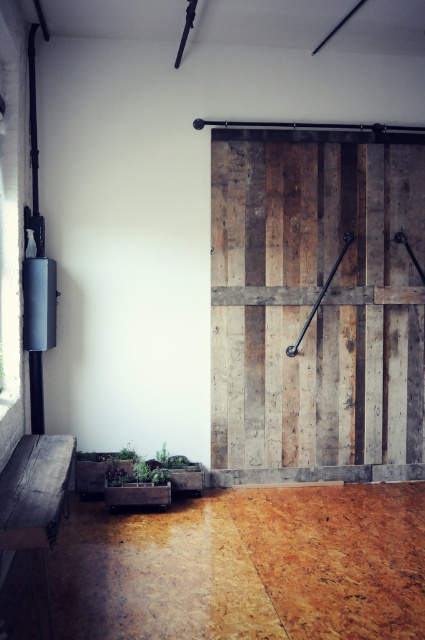
Between point (353, 376) and point (30, 536), which one is positioned behind?

The point (353, 376) is more distant.

Can you confirm if weathered wood barn door at center is wider than wooden bench at lower left?

Indeed, weathered wood barn door at center has a greater width compared to wooden bench at lower left.

Is point (326, 321) positioned after point (45, 493)?

Yes.

Where is `weathered wood barn door at center`? The width and height of the screenshot is (425, 640). weathered wood barn door at center is located at coordinates (317, 307).